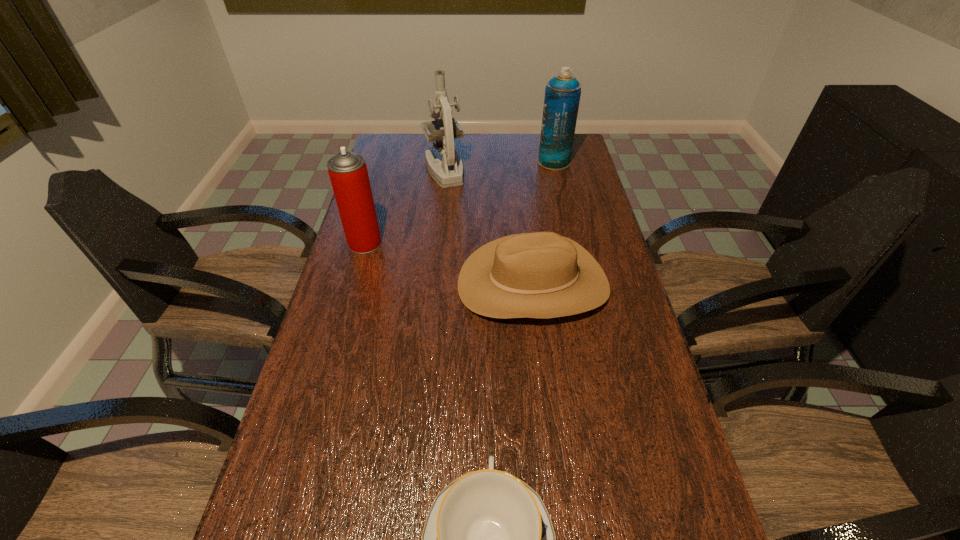
This screenshot has height=540, width=960. In order to click on aerosol can that is at the far edge in this screenshot , I will do `click(562, 93)`.

Locate an element on the screen. The width and height of the screenshot is (960, 540). object that is positioned at the left edge is located at coordinates (348, 173).

The image size is (960, 540). Identify the location of aerosol can located at the right edge. (562, 93).

Find the location of `cowboy hat present at the right edge`. cowboy hat present at the right edge is located at coordinates (537, 275).

Find the location of a particular element. This screenshot has height=540, width=960. object located in the far right corner section of the desktop is located at coordinates (562, 93).

At what (x,y) coordinates should I click in order to perform the action: click on vacant space at the far edge of the desktop. Please return your answer as a coordinate pair (x, y). The image size is (960, 540). Looking at the image, I should click on (466, 136).

Where is `free space at the left edge of the desktop`? free space at the left edge of the desktop is located at coordinates (404, 174).

Locate an element on the screen. The width and height of the screenshot is (960, 540). free space at the right edge of the desktop is located at coordinates click(548, 172).

Locate an element on the screen. vacant space that's between the second shortest object and the microscope is located at coordinates (489, 227).

I want to click on unoccupied area between the nearer aerosol can and the microscope, so click(x=404, y=207).